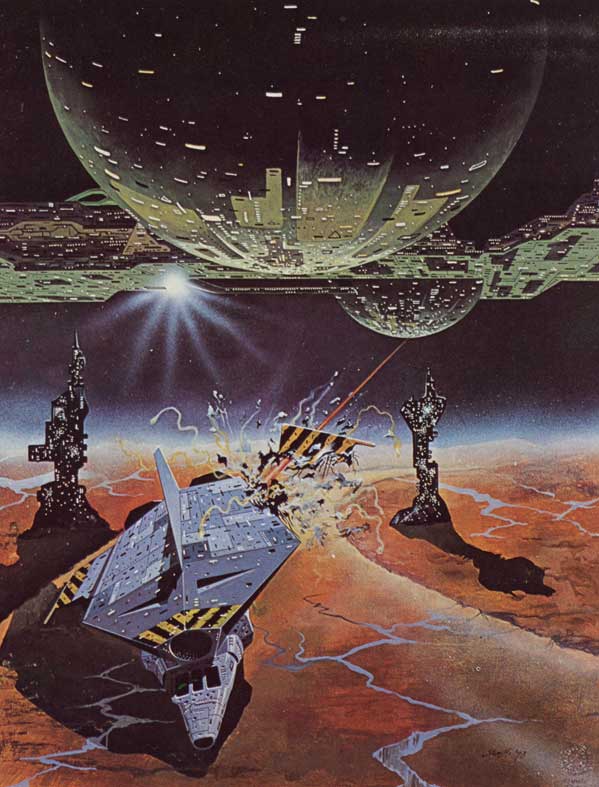
At what (x,y) coordinates should I click in order to perform the action: click on beam. Please return your answer as a coordinate pair (x, y). Image resolution: width=599 pixels, height=787 pixels. Looking at the image, I should click on (366, 382).